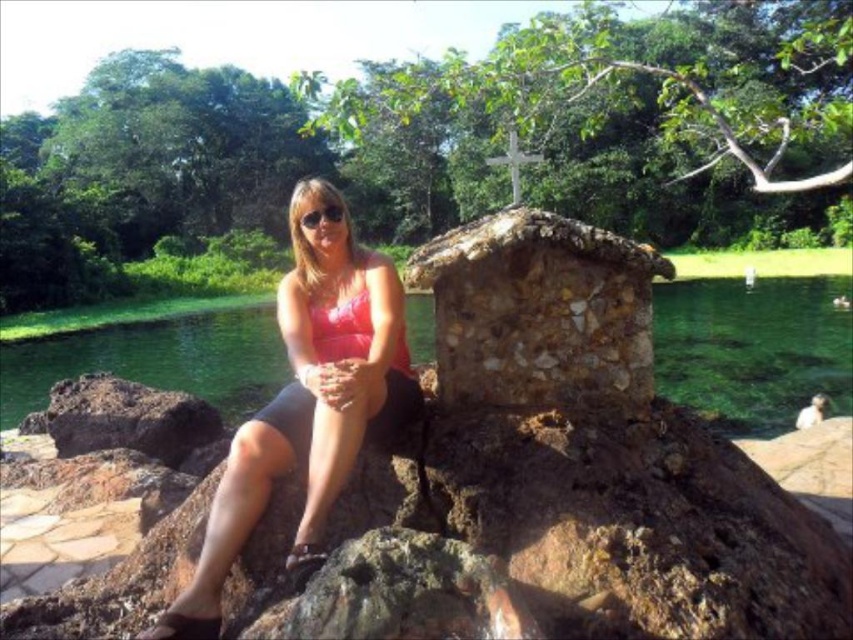
Question: Can you confirm if dark brown rock at lower left is positioned to the right of pink matte bikini top at center?

Choices:
 (A) no
 (B) yes

Answer: (A)

Question: Among these objects, which one is farthest from the camera?

Choices:
 (A) pink fabric at center
 (B) clear water at center
 (C) dark brown rock at lower left
 (D) matte black goggles at center

Answer: (C)

Question: Which point is farther to the camera?

Choices:
 (A) dark brown rock at lower left
 (B) pink matte bikini top at center
 (C) clear water at center
 (D) pink fabric at center

Answer: (A)

Question: Can you confirm if pink fabric at center is bigger than matte black goggles at center?

Choices:
 (A) yes
 (B) no

Answer: (A)

Question: Which object is closer to the camera taking this photo?

Choices:
 (A) clear water at center
 (B) pink matte bikini top at center

Answer: (B)

Question: Does dark brown rock at lower left have a lesser width compared to matte black goggles at center?

Choices:
 (A) no
 (B) yes

Answer: (A)